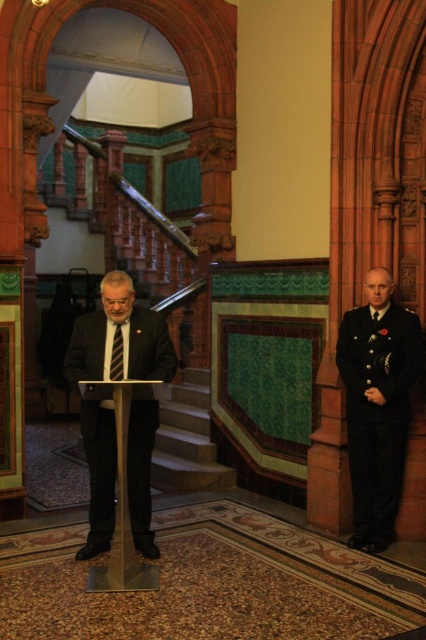
You are an event attendee and want to approach the speaker who is wearing the dark blue uniform at right. The gold metallic podium at center is in your path. Can you walk around the podium to reach the speaker?

The gold metallic podium at center is behind the dark blue uniform at right, so the podium is not blocking your path. You can walk directly towards the dark blue uniform at right without needing to go around the podium.

You are an event planner setting up for a formal ceremony. You notice the dark blue uniform at right and the gold metallic podium at center. Which object is closer to the front of the stage?

The dark blue uniform at right is positioned over the gold metallic podium at center, meaning it is closer to the front of the stage.

Where is the dark suit at center located in the image?

The dark suit at center is located at point (123,337).